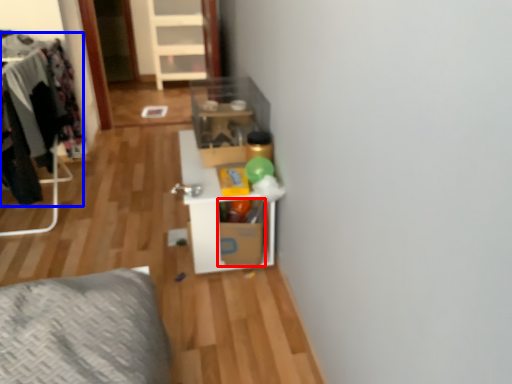
Question: Among these objects, which one is nearest to the camera, cardboard box (highlighted by a red box) or clothing (highlighted by a blue box)?

Choices:
 (A) cardboard box
 (B) clothing

Answer: (B)